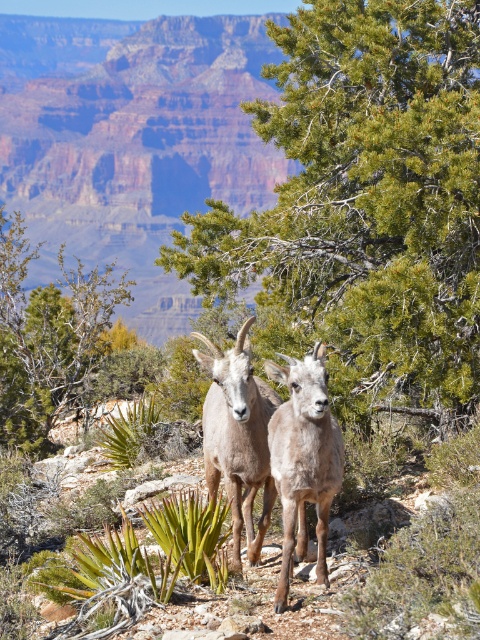
Question: Which object is positioned closest to the fuzzy brown goat at center?

Choices:
 (A) green leafy tree at center
 (B) brown woolly goat at center

Answer: (B)

Question: Is green needle-like tree at center to the right of fuzzy brown goat at center from the viewer's perspective?

Choices:
 (A) no
 (B) yes

Answer: (B)

Question: Estimate the real-world distances between objects in this image. Which object is farther from the fuzzy brown goat at center?

Choices:
 (A) green needle-like tree at center
 (B) brown woolly goat at center

Answer: (A)

Question: Is green needle-like tree at center bigger than green leafy tree at center?

Choices:
 (A) no
 (B) yes

Answer: (A)

Question: Which point is closer to the camera taking this photo?

Choices:
 (A) (6, 397)
 (B) (219, 465)
 (C) (321, 577)
 (D) (355, 204)

Answer: (C)

Question: Can you confirm if green needle-like tree at center is smaller than fuzzy brown goat at center?

Choices:
 (A) no
 (B) yes

Answer: (A)